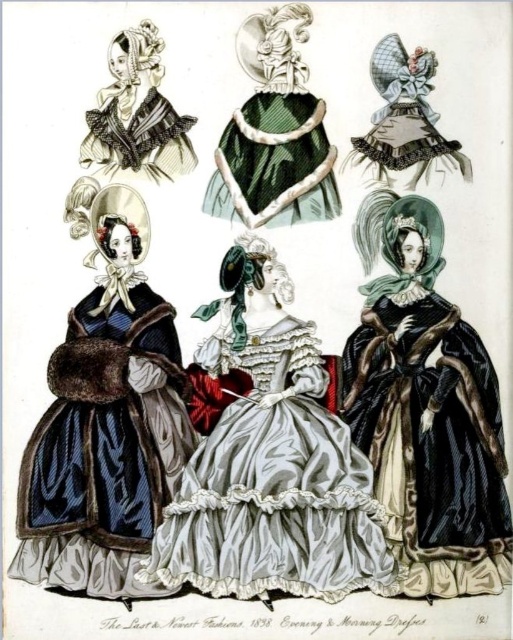
Which is more to the left, velvet fur coat at left or velvet black cape at right?

velvet fur coat at left

Does velvet fur coat at left have a greater width compared to velvet black cape at right?

Correct, the width of velvet fur coat at left exceeds that of velvet black cape at right.

Find the location of a particular element. The image size is (513, 640). velvet fur coat at left is located at coordinates (106, 420).

Describe the element at coordinates (106, 420) in the screenshot. I see `velvet fur coat at left` at that location.

What do you see at coordinates (106, 420) in the screenshot? Image resolution: width=513 pixels, height=640 pixels. I see `velvet fur coat at left` at bounding box center [106, 420].

Locate an element on the screen. velvet fur coat at left is located at coordinates (106, 420).

Locate an element on the screen. This screenshot has width=513, height=640. velvet black cape at right is located at coordinates (425, 410).

Does velvet black cape at right have a smaller size compared to matte black bonnet at upper left?

No, velvet black cape at right is not smaller than matte black bonnet at upper left.

Where is `velvet black cape at right`? The width and height of the screenshot is (513, 640). velvet black cape at right is located at coordinates (425, 410).